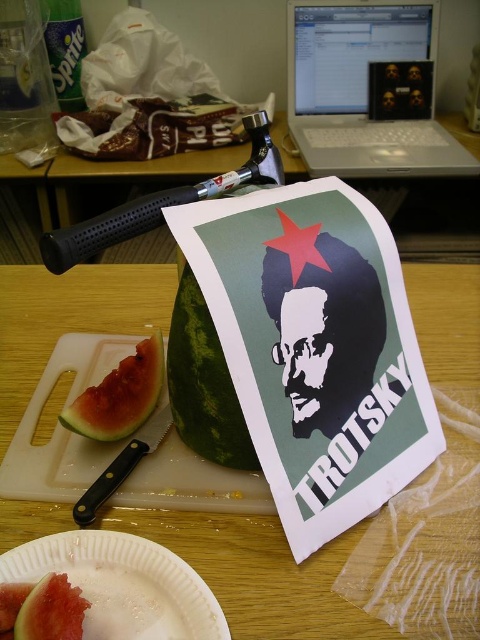
Question: Is wooden table at center above green matte watermelon at lower left?

Choices:
 (A) no
 (B) yes

Answer: (B)

Question: Among these points, which one is nearest to the camera?

Choices:
 (A) (189, 464)
 (B) (74, 426)
 (C) (34, 628)
 (D) (285, 582)

Answer: (C)

Question: Is white plastic plate at lower left further to camera compared to green matte watermelon at lower left?

Choices:
 (A) no
 (B) yes

Answer: (B)

Question: Can you confirm if white plastic plate at lower left is positioned below green matte watermelon at lower left?

Choices:
 (A) yes
 (B) no

Answer: (B)

Question: Among these objects, which one is farthest from the camera?

Choices:
 (A) green matte watermelon at lower left
 (B) white paper plate at lower left
 (C) red flesh watermelon at center

Answer: (C)

Question: Which object appears closest to the camera in this image?

Choices:
 (A) white paper plate at lower left
 (B) wooden table at center
 (C) green textured melon at center

Answer: (A)